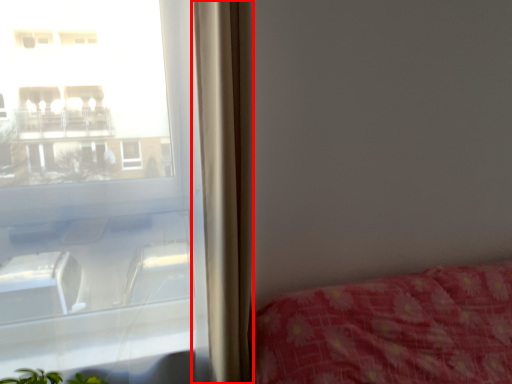
Question: In this image, where is curtain (annotated by the red box) located relative to window?

Choices:
 (A) right
 (B) left

Answer: (A)